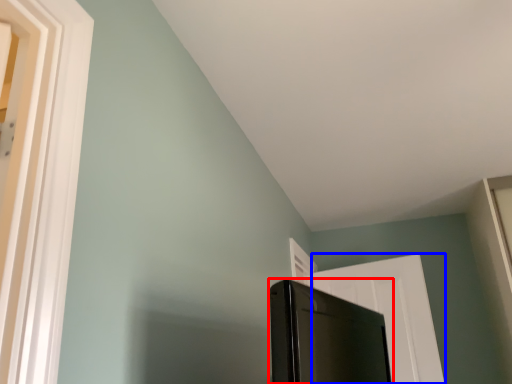
Question: Which of the following is the closest to the observer, screen door (highlighted by a red box) or door (highlighted by a blue box)?

Choices:
 (A) screen door
 (B) door

Answer: (A)